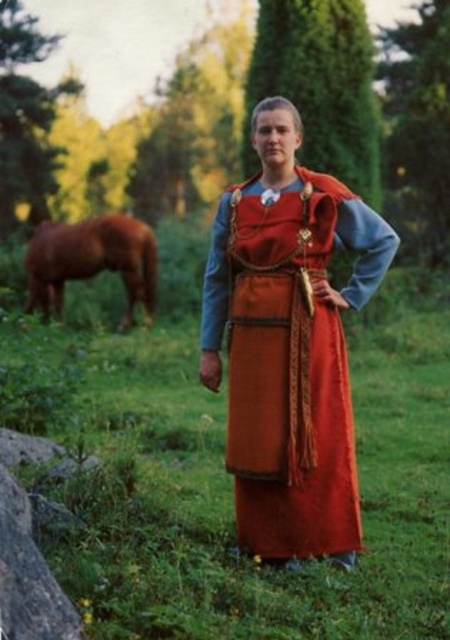
You are a photographer trying to capture a closeup of the matte orange dress at center and the brown glossy horse at left. Given that your camera can focus on objects within a 5 meter range, will you be able to get both subjects in focus at the same time?

The matte orange dress at center is 7.92 meters away from the brown glossy horse at left. Since the camera can only focus within 5 meters, the distance between them exceeds the focus range, so both subjects cannot be in focus simultaneously.

You are a photographer trying to capture a closeup of the person in the scene. You notice two points in the image at coordinates point (127,500) and point (248,531). Which point should you focus on to ensure the person is in focus?

You should focus on point (127,500) because it is closer to the camera than point (248,531), ensuring the person is in focus.

You are a photographer trying to capture the matte orange dress at center and the green grass at center in the same frame. Which object should you position your camera closer to in order to include both in the shot?

The green grass at center is to the left of the matte orange dress at center, so positioning the camera closer to the matte orange dress at center will allow you to capture both objects in the frame.